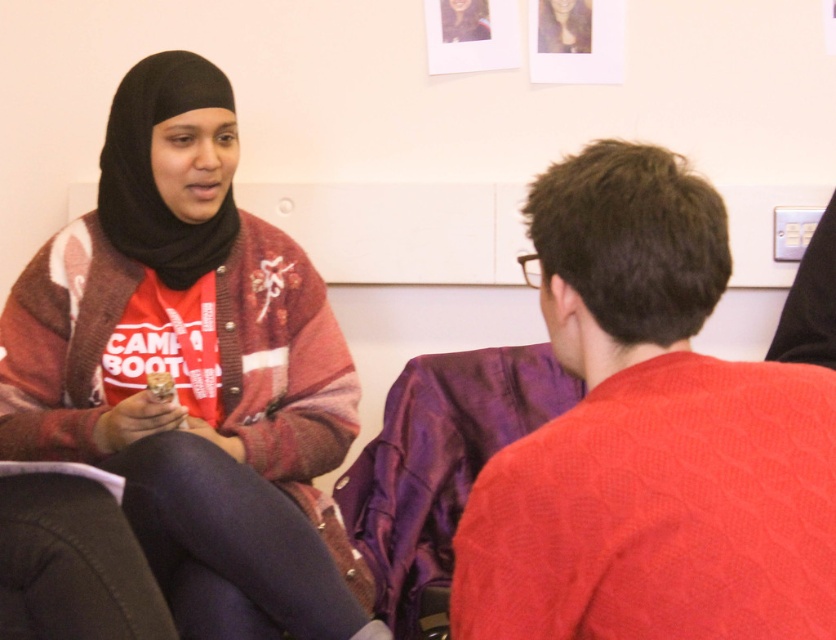
Who is lower down, red sweater at right or purple satin shawl at center?

Positioned lower is purple satin shawl at center.

This screenshot has width=836, height=640. What do you see at coordinates (650, 438) in the screenshot?
I see `red sweater at right` at bounding box center [650, 438].

Who is more distant from viewer, (x=595, y=579) or (x=516, y=438)?

The point (x=516, y=438) is more distant.

Identify the location of red sweater at right. The image size is (836, 640). (650, 438).

Is red sweater at right taller than matte black hijab at upper left?

Yes, red sweater at right is taller than matte black hijab at upper left.

Consider the image. Who is positioned more to the right, red sweater at right or matte black hijab at upper left?

red sweater at right

Where is `red sweater at right`? This screenshot has width=836, height=640. red sweater at right is located at coordinates (650, 438).

Is red sweater at right wider than matte brown cookie at center?

Indeed, red sweater at right has a greater width compared to matte brown cookie at center.

Is red sweater at right to the right of matte brown cookie at center from the viewer's perspective?

Indeed, red sweater at right is positioned on the right side of matte brown cookie at center.

Does point (737, 400) come farther from viewer compared to point (146, 381)?

No, it is not.

Where is `red sweater at right`? This screenshot has height=640, width=836. red sweater at right is located at coordinates (650, 438).